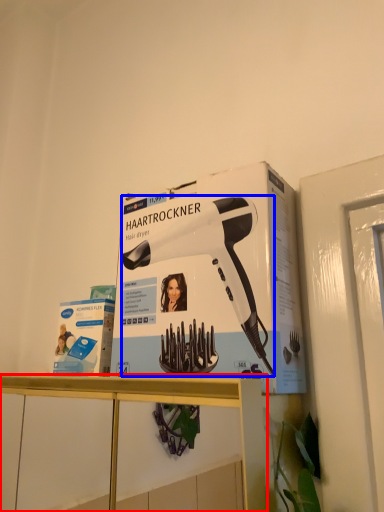
Question: Which object appears closest to the camera in this image, furniture (highlighted by a red box) or hair drier (highlighted by a blue box)?

Choices:
 (A) furniture
 (B) hair drier

Answer: (A)